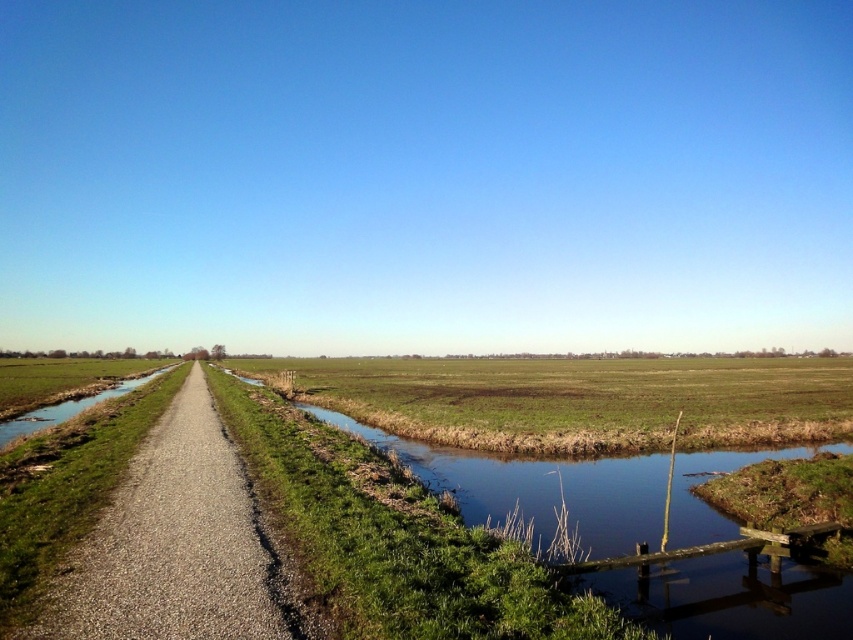
Is green grassy stream at center smaller than gravel road at center?

Incorrect, green grassy stream at center is not smaller in size than gravel road at center.

Is point (709, 538) more distant than point (180, 452)?

No, (709, 538) is closer to viewer.

This screenshot has width=853, height=640. Identify the location of green grassy stream at center. (538, 486).

Who is shorter, green grassy field at center or green grassy stream at center?

Standing shorter between the two is green grassy stream at center.

Between green grassy field at center and green grassy stream at center, which one appears on the left side from the viewer's perspective?

Positioned to the left is green grassy stream at center.

Who is more distant from viewer, (560, 404) or (625, 595)?

The point (560, 404) is more distant.

The height and width of the screenshot is (640, 853). Identify the location of green grassy field at center. (582, 401).

Does green grassy field at center appear under gravel road at center?

Indeed, green grassy field at center is positioned under gravel road at center.

Is green grassy field at center smaller than gravel road at center?

Incorrect, green grassy field at center is not smaller in size than gravel road at center.

Who is more forward, (555, 371) or (236, 480)?

Point (236, 480) is in front.

This screenshot has height=640, width=853. In order to click on green grassy field at center in this screenshot , I will do `click(582, 401)`.